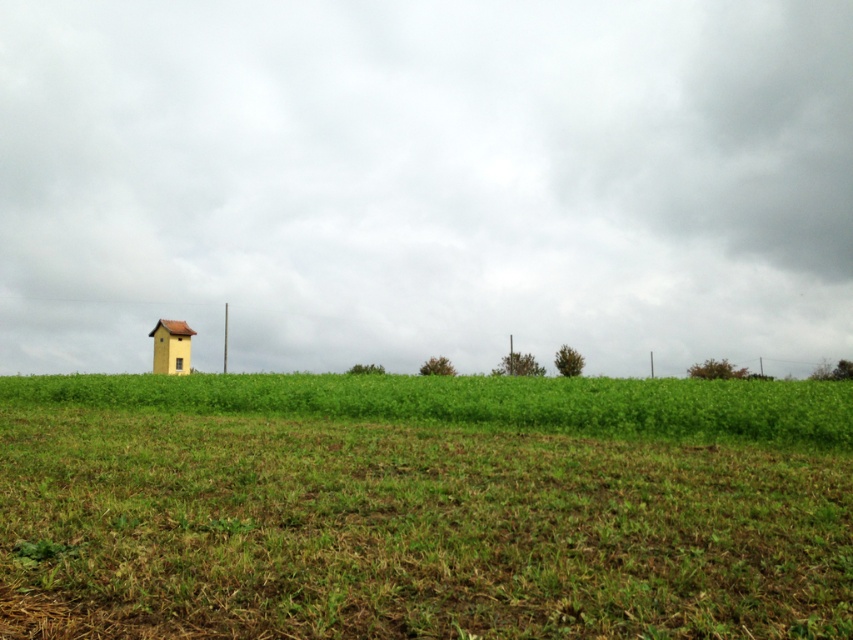
Question: Can you confirm if matte yellow building at left is thinner than green grassy field at center?

Choices:
 (A) no
 (B) yes

Answer: (A)

Question: Which object is the farthest from the matte yellow building at left?

Choices:
 (A) yellow matte hut at left
 (B) green grassy field at center

Answer: (B)

Question: Which of the following is the closest to the observer?

Choices:
 (A) green grassy field at center
 (B) yellow matte hut at left
 (C) matte yellow building at left

Answer: (A)

Question: Is green grassy field at center above yellow matte hut at left?

Choices:
 (A) no
 (B) yes

Answer: (A)

Question: Is matte yellow building at left below yellow matte hut at left?

Choices:
 (A) no
 (B) yes

Answer: (A)

Question: Among these points, which one is nearest to the camera?

Choices:
 (A) (137, 488)
 (B) (187, 358)
 (C) (508, 225)

Answer: (A)